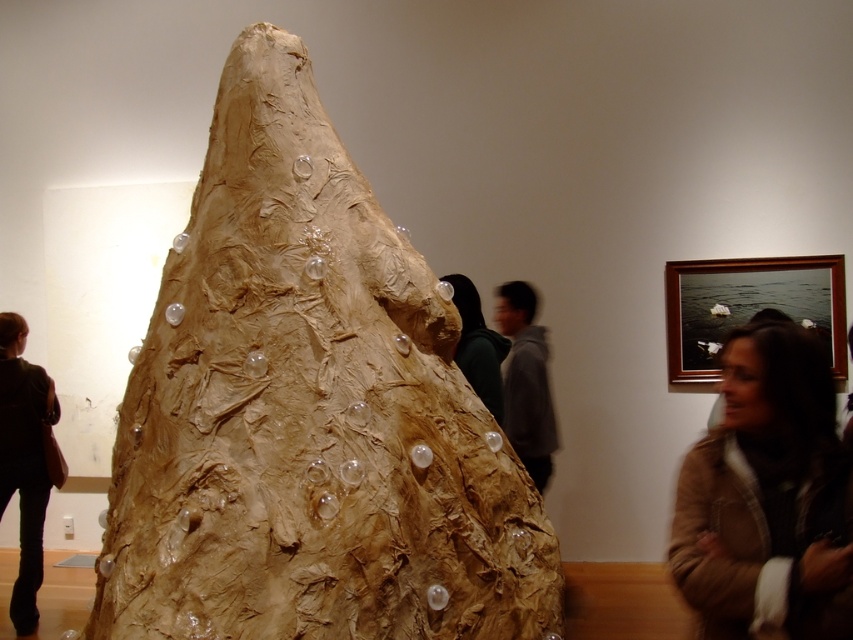
You are standing in an art gallery and want to take a photo of the sculpture. The camera you have can only focus on objects within 5 feet. Is the point at coordinates point (277, 353) within the camera focus range?

The point at coordinates point (277, 353) is 7.21 feet away from the camera, which is beyond the camera focus range of 5 feet. Therefore, the camera cannot focus on that point.

You are an art curator planning to move the brown textured jacket at lower right closer to the matte brown sculpture at center. Based on their sizes, will the jacket fit next to the sculpture without overlapping?

The matte brown sculpture at center might be wider than brown textured jacket at lower right, so there is a possibility that the jacket could fit next to it without overlapping, but the exact dimensions are uncertain.

You are an art student who wants to take a photo of the matte brown sculpture at center and the brown textured jacket at lower right. Since you want to focus on the sculpture, which object should you avoid blocking the camera lens with?

You should avoid blocking the camera lens with the brown textured jacket at lower right because the matte brown sculpture at center is positioned over it, meaning the sculpture is in front and the jacket is behind. This way, focusing on the sculpture won